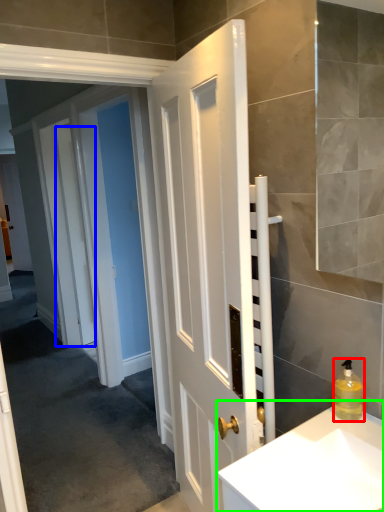
Question: Estimate the real-world distances between objects in this image. Which object is farther from soap dispenser (highlighted by a red box), door (highlighted by a blue box) or sink (highlighted by a green box)?

Choices:
 (A) door
 (B) sink

Answer: (A)